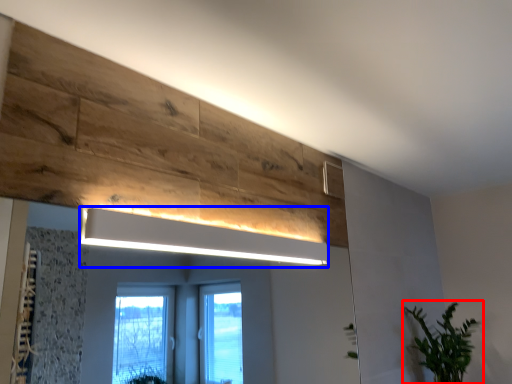
Question: Which point is further to the camera, houseplant (highlighted by a red box) or light fixture (highlighted by a blue box)?

Choices:
 (A) houseplant
 (B) light fixture

Answer: (A)